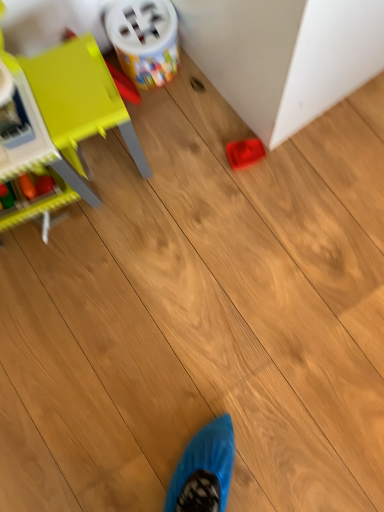
Question: Is plastic container at upper center, acting as the second toy starting from the left, oriented away from rubberized red tray at lower right?

Choices:
 (A) no
 (B) yes

Answer: (A)

Question: From a real-world perspective, is plastic container at upper center, acting as the second toy starting from the left, physically above rubberized red tray at lower right?

Choices:
 (A) no
 (B) yes

Answer: (A)

Question: Is plastic container at upper center, arranged as the second toy when viewed from the right, to the left of rubberized red tray at lower right from the viewer's perspective?

Choices:
 (A) no
 (B) yes

Answer: (B)

Question: Does plastic container at upper center, acting as the second toy starting from the left, turn towards rubberized red tray at lower right?

Choices:
 (A) yes
 (B) no

Answer: (B)

Question: Is plastic container at upper center, arranged as the second toy when viewed from the right, far from rubberized red tray at lower right?

Choices:
 (A) yes
 (B) no

Answer: (B)

Question: In terms of height, does matte yellow chair at left, which is the 3th toy in right-to-left order, look taller or shorter compared to rubberized red tray at lower right?

Choices:
 (A) tall
 (B) short

Answer: (A)

Question: Looking at their shapes, would you say matte yellow chair at left, which is the 3th toy in right-to-left order, is wider or thinner than rubberized red tray at lower right?

Choices:
 (A) thin
 (B) wide

Answer: (A)

Question: Visually, is matte yellow chair at left, which is the 3th toy in right-to-left order, positioned to the left or to the right of rubberized red tray at lower right?

Choices:
 (A) left
 (B) right

Answer: (A)

Question: Would you say matte yellow chair at left, which is the 3th toy in right-to-left order, is inside or outside rubberized red tray at lower right?

Choices:
 (A) outside
 (B) inside

Answer: (A)

Question: Looking at the image, does rubberized red tray at lower right seem bigger or smaller compared to matte plastic tray at center-right, the 3th toy when ordered from left to right?

Choices:
 (A) big
 (B) small

Answer: (A)

Question: Relative to matte plastic tray at center-right, arranged as the first toy when viewed from the right, is rubberized red tray at lower right in front or behind?

Choices:
 (A) front
 (B) behind

Answer: (A)

Question: Does point click(x=264, y=11) appear closer or farther from the camera than point click(x=251, y=138)?

Choices:
 (A) farther
 (B) closer

Answer: (B)

Question: Looking at their shapes, would you say rubberized red tray at lower right is wider or thinner than matte plastic tray at center-right, the 3th toy when ordered from left to right?

Choices:
 (A) wide
 (B) thin

Answer: (A)

Question: Is point (127, 33) positioned closer to the camera than point (8, 146)?

Choices:
 (A) farther
 (B) closer

Answer: (A)

Question: From the image's perspective, is plastic container at upper center, arranged as the second toy when viewed from the right, above or below matte yellow chair at left, which is the 3th toy in right-to-left order?

Choices:
 (A) above
 (B) below

Answer: (A)